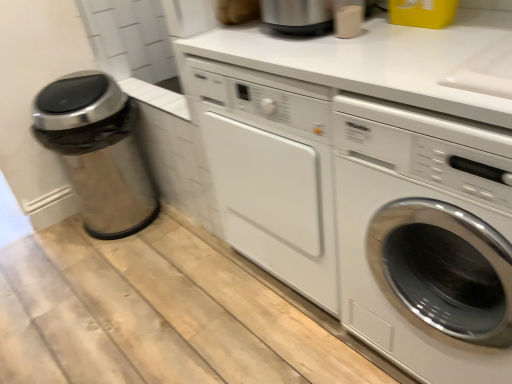
Question: Would you say stainless steel trash can at left is to the left or to the right of white glossy washing machine at center right in the picture?

Choices:
 (A) right
 (B) left

Answer: (B)

Question: From their relative heights in the image, would you say stainless steel trash can at left is taller or shorter than white glossy washing machine at center right?

Choices:
 (A) tall
 (B) short

Answer: (B)

Question: From the image's perspective, is stainless steel trash can at left positioned above or below white glossy washing machine at center right?

Choices:
 (A) below
 (B) above

Answer: (B)

Question: Looking at the image, does white glossy washing machine at center right seem bigger or smaller compared to stainless steel trash can at left?

Choices:
 (A) small
 (B) big

Answer: (B)

Question: From their relative heights in the image, would you say white glossy washing machine at center right is taller or shorter than stainless steel trash can at left?

Choices:
 (A) short
 (B) tall

Answer: (B)

Question: Is white glossy washing machine at center right spatially inside stainless steel trash can at left, or outside of it?

Choices:
 (A) inside
 (B) outside

Answer: (B)

Question: From a real-world perspective, relative to stainless steel trash can at left, is white glossy washing machine at center right vertically above or below?

Choices:
 (A) above
 (B) below

Answer: (A)